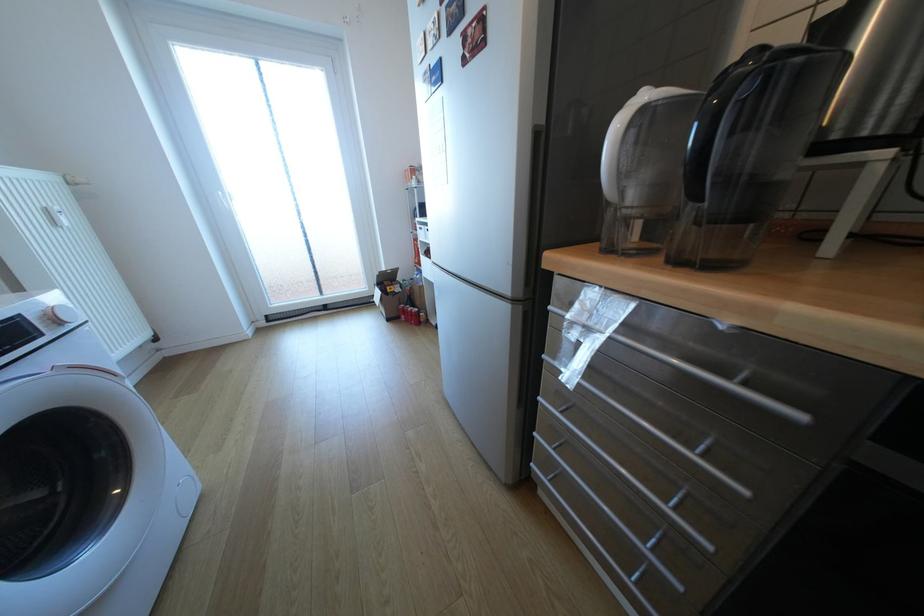
Where would you turn the radiator thermostat knob? Please return your answer as a coordinate pair (x, y).

(58, 213)